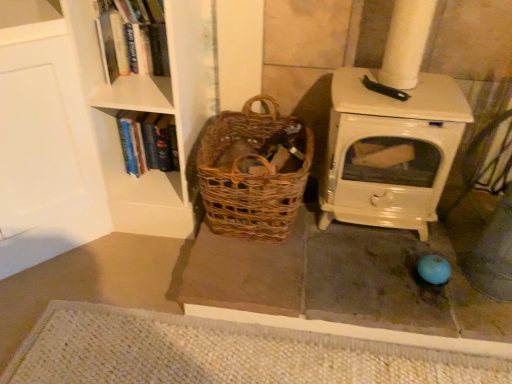
Question: From a real-world perspective, is hardcover book at left, the 2th book from the top, located beneath hardcover book at upper left, which is the 2th book in back-to-front order?

Choices:
 (A) yes
 (B) no

Answer: (A)

Question: Can hardcover book at upper left, the 2th book positioned from the bottom, be found inside hardcover book at left, placed as the first book when sorted from back to front?

Choices:
 (A) no
 (B) yes

Answer: (A)

Question: From the image's perspective, is hardcover book at left, placed as the first book when sorted from back to front, on top of hardcover book at upper left, the first book when ordered from front to back?

Choices:
 (A) no
 (B) yes

Answer: (A)

Question: Does hardcover book at left, placed as the second book when sorted from front to back, appear on the right side of hardcover book at upper left, the first book when ordered from front to back?

Choices:
 (A) yes
 (B) no

Answer: (B)

Question: Can you confirm if hardcover book at left, the 2th book from the top, is thinner than hardcover book at upper left, which ranks as the 1th book in top-to-bottom order?

Choices:
 (A) yes
 (B) no

Answer: (B)

Question: From the image's perspective, relative to woven brown basket at center, is hardcover book at upper left, the 2th book positioned from the bottom, above or below?

Choices:
 (A) below
 (B) above

Answer: (B)

Question: In the image, is hardcover book at upper left, the 2th book positioned from the bottom, on the left side or the right side of woven brown basket at center?

Choices:
 (A) left
 (B) right

Answer: (A)

Question: Is point (144, 16) positioned closer to the camera than point (218, 132)?

Choices:
 (A) farther
 (B) closer

Answer: (B)

Question: Is hardcover book at upper left, the first book when ordered from front to back, in front of or behind woven brown basket at center in the image?

Choices:
 (A) behind
 (B) front

Answer: (A)

Question: From a real-world perspective, relative to white woven mat at lower center, is hardcover book at left, placed as the second book when sorted from front to back, vertically above or below?

Choices:
 (A) above
 (B) below

Answer: (A)

Question: Considering the relative positions of hardcover book at left, placed as the second book when sorted from front to back, and white woven mat at lower center in the image provided, is hardcover book at left, placed as the second book when sorted from front to back, to the left or to the right of white woven mat at lower center?

Choices:
 (A) left
 (B) right

Answer: (A)

Question: Is hardcover book at left, the 2th book from the top, wider or thinner than white woven mat at lower center?

Choices:
 (A) wide
 (B) thin

Answer: (B)

Question: Considering the positions of point (176, 165) and point (220, 370), is point (176, 165) closer or farther from the camera than point (220, 370)?

Choices:
 (A) farther
 (B) closer

Answer: (A)

Question: Would you say hardcover book at upper left, the 2th book positioned from the bottom, is inside or outside hardcover book at left, which is the first book in bottom-to-top order?

Choices:
 (A) outside
 (B) inside

Answer: (A)

Question: Considering the positions of hardcover book at upper left, which is the 2th book in back-to-front order, and hardcover book at left, the 2th book from the top, in the image, is hardcover book at upper left, which is the 2th book in back-to-front order, taller or shorter than hardcover book at left, the 2th book from the top,?

Choices:
 (A) tall
 (B) short

Answer: (A)